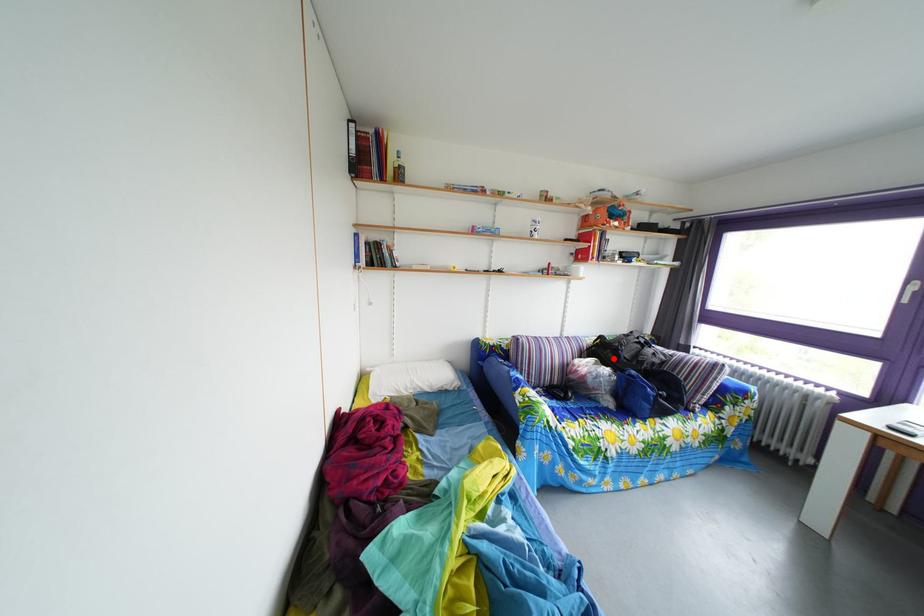
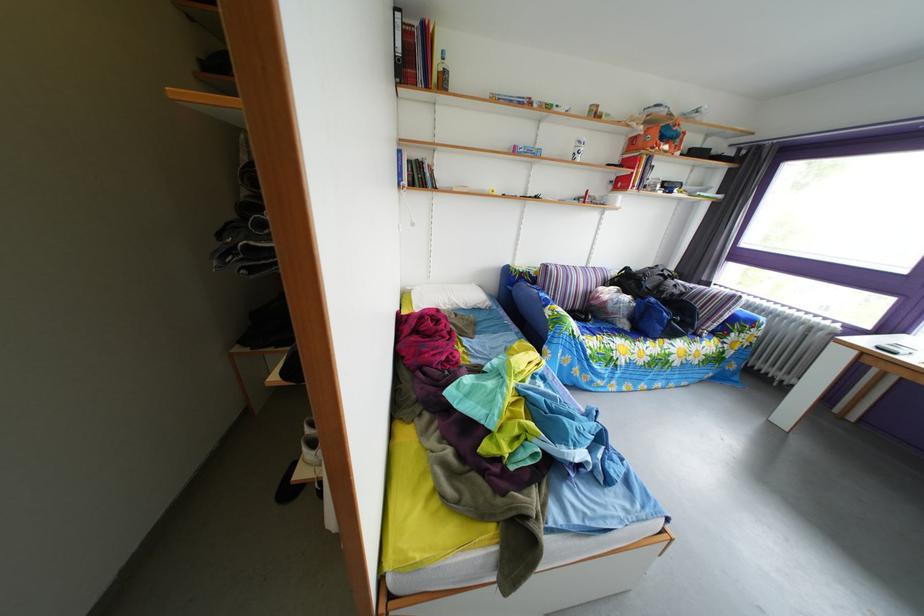
The point at the highlighted location is marked in the first image. Where is the corresponding point in the second image?

(638, 289)